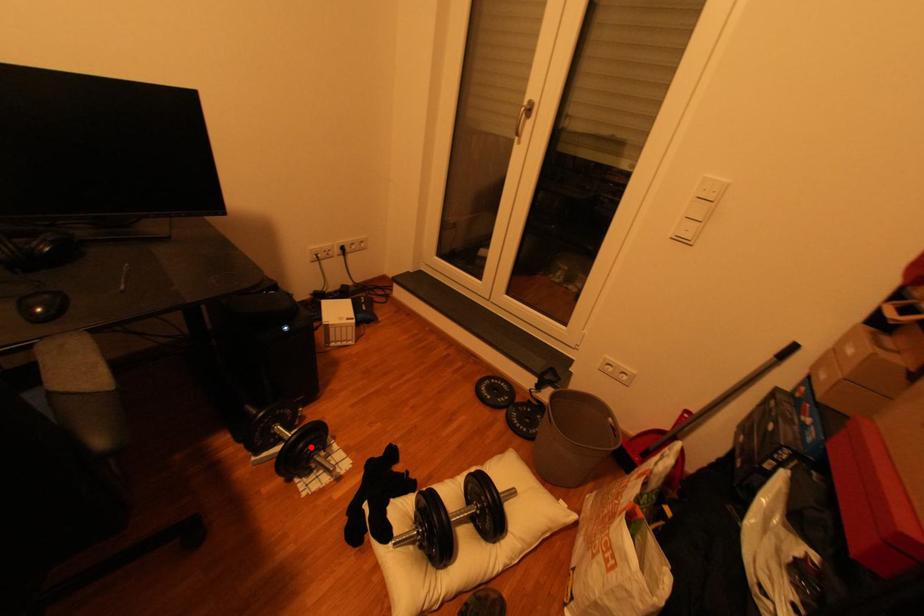
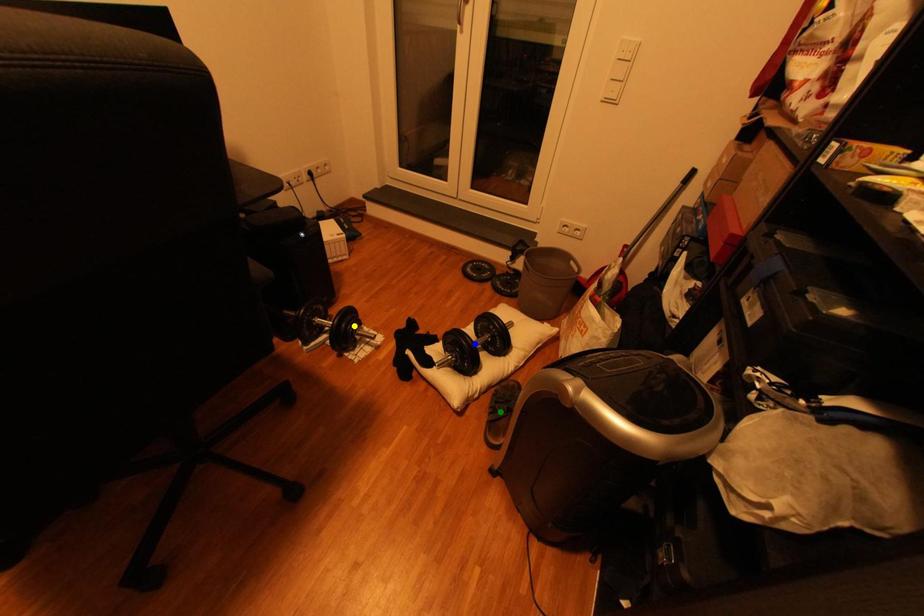
Question: I am providing you with two images of the same scene from different viewpoints. A red point is marked on the first image. You are given multiple points on the second image. Can you choose the point in image 2 that corresponds to the point in image 1?

Choices:
 (A) blue point
 (B) yellow point
 (C) green point

Answer: (B)